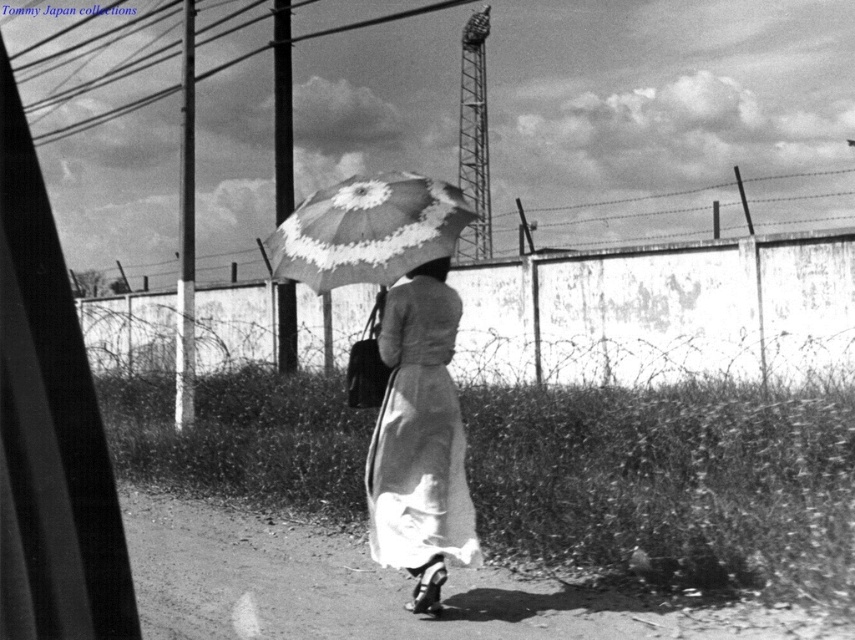
You are an observer standing behind the woman in the scene. You notice the matte gray dress at center and the smooth fabric hat at upper center. Which object is taller when viewed from your perspective?

The matte gray dress at center is taller than the smooth fabric hat at upper center according to the description.